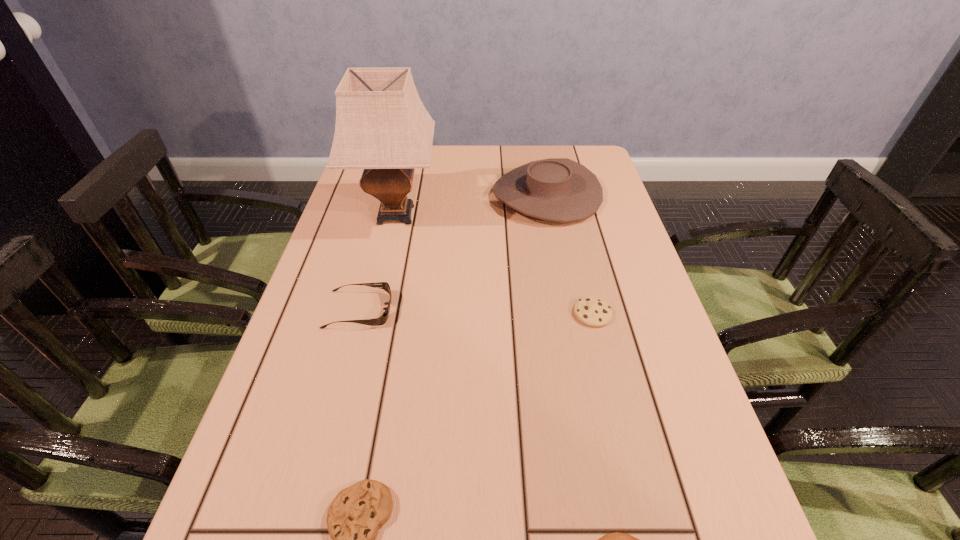
At what (x,y) coordinates should I click in order to perform the action: click on sunglasses present at the left edge. Please return your answer as a coordinate pair (x, y). The image size is (960, 540). Looking at the image, I should click on (382, 319).

Where is `cowboy hat that is positioned at the right edge`? The height and width of the screenshot is (540, 960). cowboy hat that is positioned at the right edge is located at coordinates (556, 189).

Where is `cookie that is at the right edge`? This screenshot has height=540, width=960. cookie that is at the right edge is located at coordinates (595, 312).

The height and width of the screenshot is (540, 960). I want to click on object positioned at the far right corner, so click(556, 189).

Locate an element on the screen. vacant area at the far edge is located at coordinates (446, 175).

Identify the location of free space at the left edge of the desktop. (319, 349).

Identify the location of vacant point at the right edge. The image size is (960, 540). (636, 391).

Locate an element on the screen. vacant area at the far left corner of the desktop is located at coordinates (357, 177).

Image resolution: width=960 pixels, height=540 pixels. I want to click on free spot at the far right corner of the desktop, so click(605, 167).

This screenshot has height=540, width=960. Find the location of `free space that is in between the sunglasses and the tallest object`. free space that is in between the sunglasses and the tallest object is located at coordinates (377, 262).